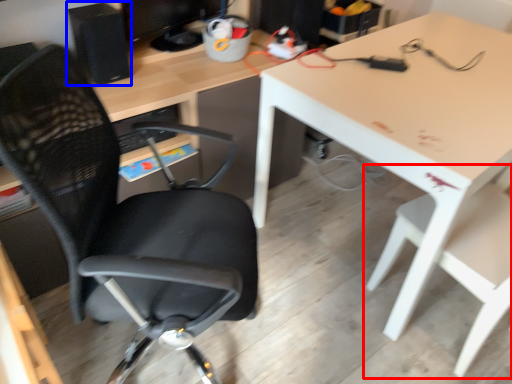
Question: Which of the following is the closest to the observer, chair (highlighted by a red box) or computer tower (highlighted by a blue box)?

Choices:
 (A) chair
 (B) computer tower

Answer: (A)